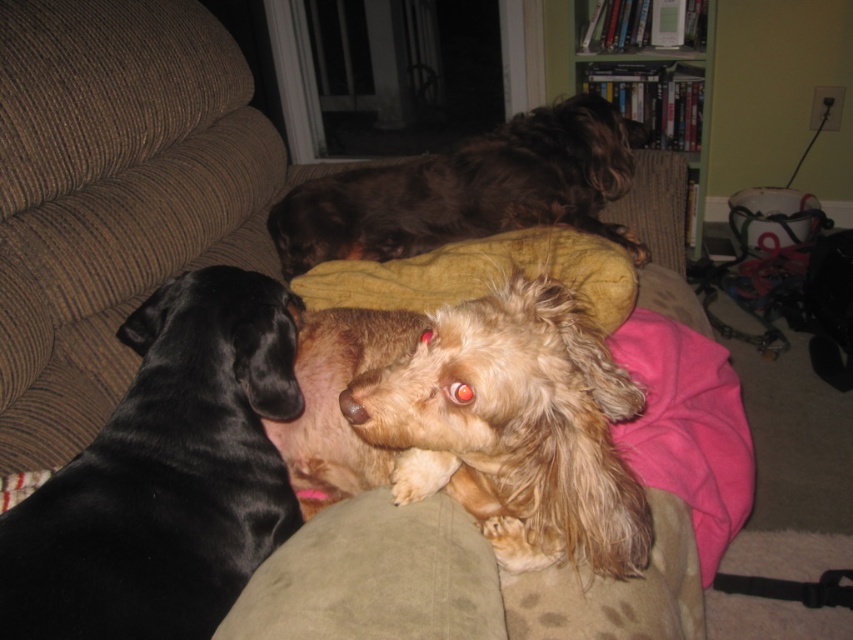
Question: Is black shiny dog at left smaller than fuzzy brown dog at center?

Choices:
 (A) no
 (B) yes

Answer: (A)

Question: Which of these objects is positioned closest to the fuzzy brown dog at center?

Choices:
 (A) black shiny dog at left
 (B) shiny brown fur at upper center

Answer: (A)

Question: Which of these objects is positioned farthest from the shiny brown fur at upper center?

Choices:
 (A) fuzzy brown dog at center
 (B) black shiny dog at left

Answer: (A)

Question: Is black shiny dog at left further to camera compared to shiny brown fur at upper center?

Choices:
 (A) no
 (B) yes

Answer: (A)

Question: Does black shiny dog at left have a smaller size compared to shiny brown fur at upper center?

Choices:
 (A) no
 (B) yes

Answer: (B)

Question: Which of these objects is positioned closest to the black shiny dog at left?

Choices:
 (A) fuzzy brown dog at center
 (B) shiny brown fur at upper center

Answer: (A)